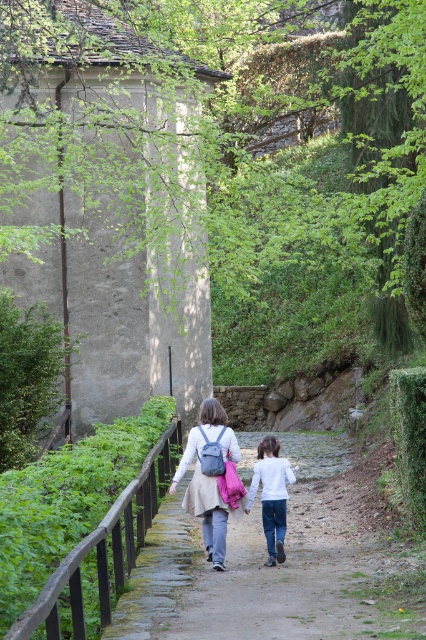
Who is shorter, smooth stone path at center or matte blue backpack at center?

smooth stone path at center is shorter.

Who is positioned more to the right, smooth stone path at center or matte blue backpack at center?

smooth stone path at center is more to the right.

Identify the location of smooth stone path at center. This screenshot has width=426, height=640. (279, 566).

Describe the element at coordinates (209, 477) in the screenshot. I see `matte blue backpack at center` at that location.

Where is `matte blue backpack at center`? The image size is (426, 640). matte blue backpack at center is located at coordinates (209, 477).

Who is lower down, smooth stone path at center or white matte shirt at center?

Positioned lower is smooth stone path at center.

Is smooth stone path at center to the left of white matte shirt at center from the viewer's perspective?

In fact, smooth stone path at center is to the right of white matte shirt at center.

At what (x,y) coordinates should I click in order to perform the action: click on smooth stone path at center. Please return your answer as a coordinate pair (x, y). The image size is (426, 640). Looking at the image, I should click on (279, 566).